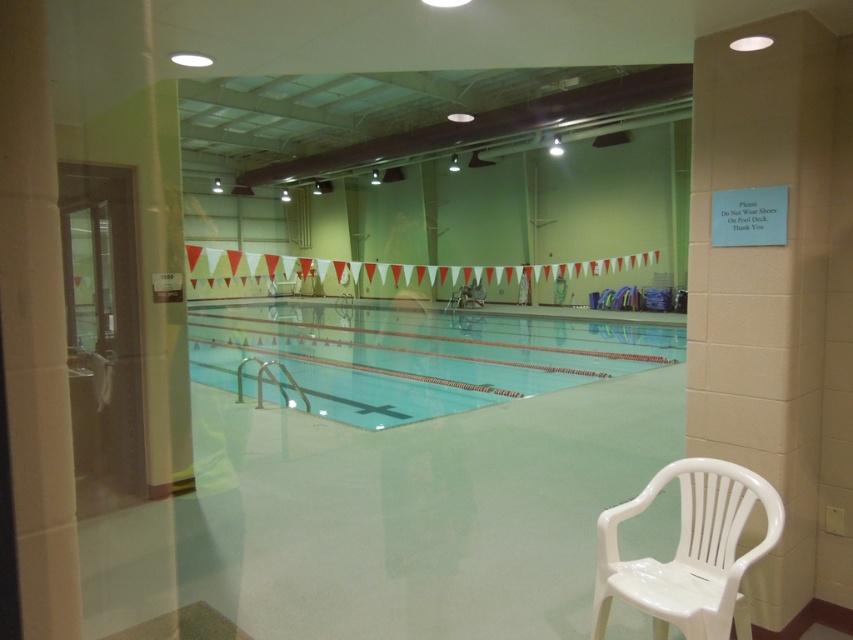
Who is lower down, clear glass pool at center or white plastic chair at lower right?

white plastic chair at lower right is lower down.

Who is positioned more to the right, clear glass pool at center or white plastic chair at lower right?

Positioned to the right is white plastic chair at lower right.

Who is more forward, (248,362) or (738,605)?

Point (738,605)

In order to click on clear glass pool at center in this screenshot , I will do `click(415, 355)`.